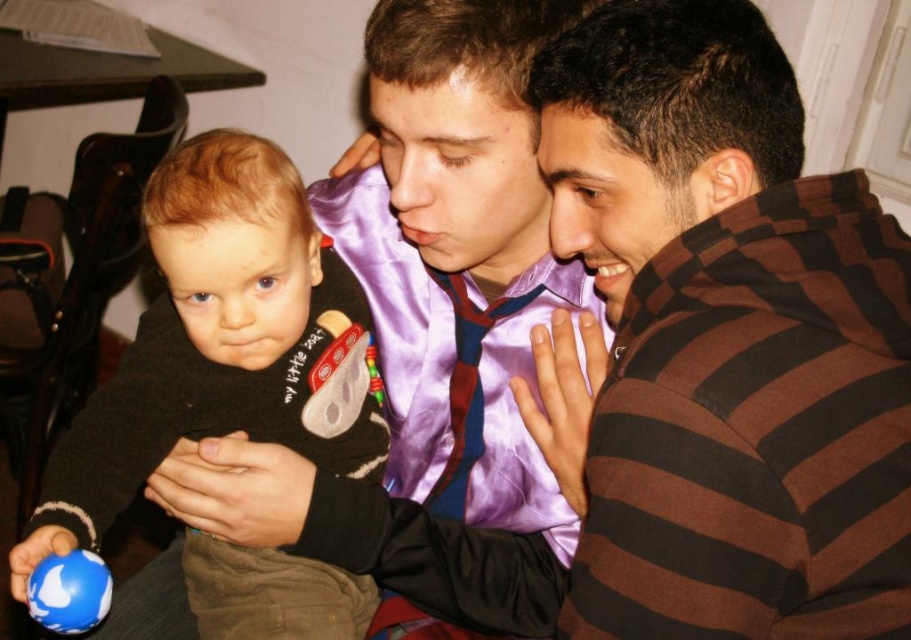
Who is positioned more to the left, soft black sweater at center or blue rubber ball at lower left?

blue rubber ball at lower left

Is point (77, 470) positioned in front of point (96, 620)?

No, (77, 470) is further to viewer.

The image size is (911, 640). I want to click on soft black sweater at center, so click(220, 342).

Which is more to the right, brown striped shirt at right or soft black sweater at center?

Positioned to the right is brown striped shirt at right.

Is brown striped shirt at right above soft black sweater at center?

Yes, brown striped shirt at right is above soft black sweater at center.

The height and width of the screenshot is (640, 911). What do you see at coordinates (725, 340) in the screenshot?
I see `brown striped shirt at right` at bounding box center [725, 340].

Locate an element on the screen. Image resolution: width=911 pixels, height=640 pixels. brown striped shirt at right is located at coordinates (725, 340).

Is point (430, 262) positioned after point (62, 589)?

Yes, it is.

Between point (495, 570) and point (49, 620), which one is positioned in front?

Point (49, 620) is more forward.

Image resolution: width=911 pixels, height=640 pixels. I want to click on black fleece sweater at left, so click(431, 339).